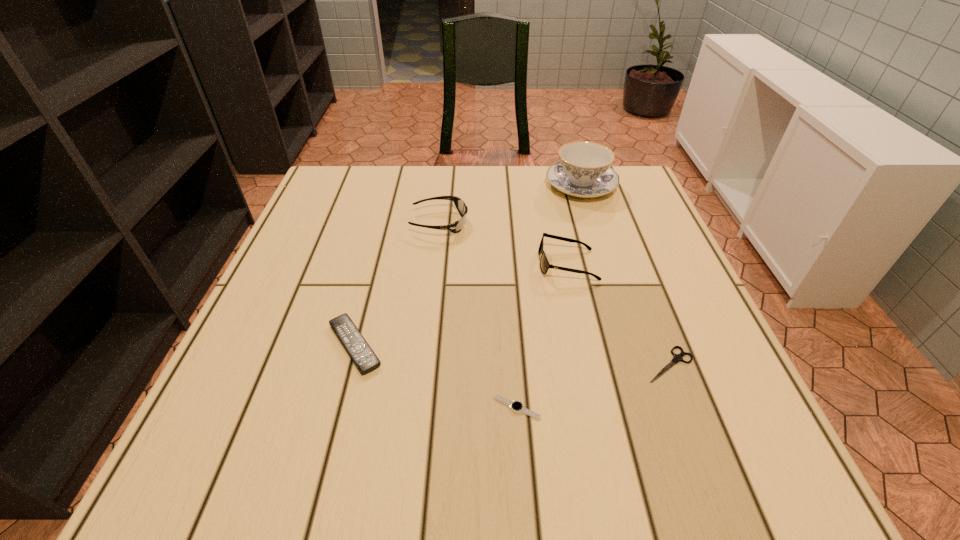
The image size is (960, 540). In order to click on shears in this screenshot , I will do `click(677, 358)`.

Find the location of a particular element. vacant region located on the front-facing side of the right sunglasses is located at coordinates (462, 264).

Find the location of `vacant space situated 0.170m on the front-facing side of the right sunglasses`. vacant space situated 0.170m on the front-facing side of the right sunglasses is located at coordinates (462, 264).

At what (x,y) coordinates should I click in order to perform the action: click on vacant space located on the front-facing side of the right sunglasses. Please return your answer as a coordinate pair (x, y). The width and height of the screenshot is (960, 540). Looking at the image, I should click on (489, 264).

This screenshot has height=540, width=960. Identify the location of free space located 0.160m on the lenses of the fifth nearest object. (533, 222).

Identify the location of vacant space positioned on the right of the remote control. (457, 345).

Find the location of a particular element. The width and height of the screenshot is (960, 540). vacant space situated 0.090m on the back of the third object from left to right is located at coordinates click(513, 352).

This screenshot has width=960, height=540. Find the location of `vacant area situated 0.290m on the left of the shears`. vacant area situated 0.290m on the left of the shears is located at coordinates (479, 364).

At what (x,y) coordinates should I click in order to perform the action: click on chinaware at the far edge. Please return your answer as a coordinate pair (x, y). This screenshot has width=960, height=540. Looking at the image, I should click on (x=584, y=170).

Locate an element on the screen. The width and height of the screenshot is (960, 540). sunglasses situated at the far edge is located at coordinates (457, 226).